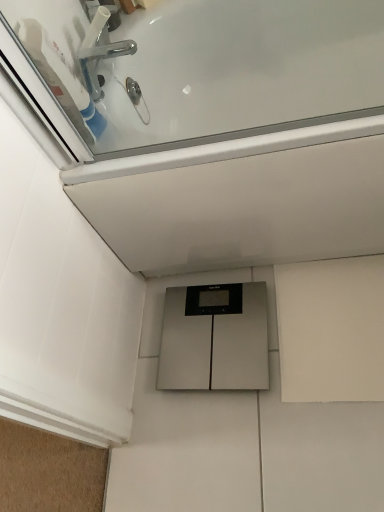
Question: Is silver metallic scale at center smaller than white glossy bathtub at upper center?

Choices:
 (A) no
 (B) yes

Answer: (B)

Question: Is there a large distance between silver metallic scale at center and white glossy bathtub at upper center?

Choices:
 (A) no
 (B) yes

Answer: (A)

Question: Is silver metallic scale at center behind white glossy bathtub at upper center?

Choices:
 (A) yes
 (B) no

Answer: (A)

Question: From the image's perspective, is silver metallic scale at center over white glossy bathtub at upper center?

Choices:
 (A) no
 (B) yes

Answer: (A)

Question: Is silver metallic scale at center closer to camera compared to white glossy bathtub at upper center?

Choices:
 (A) no
 (B) yes

Answer: (A)

Question: Can you confirm if silver metallic scale at center is bigger than white glossy bathtub at upper center?

Choices:
 (A) yes
 (B) no

Answer: (B)

Question: Can you confirm if chrome metallic faucet at upper left is shorter than silver metallic scale at center?

Choices:
 (A) yes
 (B) no

Answer: (B)

Question: Can you confirm if chrome metallic faucet at upper left is positioned to the left of silver metallic scale at center?

Choices:
 (A) yes
 (B) no

Answer: (A)

Question: Considering the relative positions of chrome metallic faucet at upper left and silver metallic scale at center in the image provided, is chrome metallic faucet at upper left in front of silver metallic scale at center?

Choices:
 (A) no
 (B) yes

Answer: (B)

Question: Are chrome metallic faucet at upper left and silver metallic scale at center making contact?

Choices:
 (A) no
 (B) yes

Answer: (A)

Question: From a real-world perspective, does chrome metallic faucet at upper left sit lower than silver metallic scale at center?

Choices:
 (A) yes
 (B) no

Answer: (B)

Question: Is chrome metallic faucet at upper left behind silver metallic scale at center?

Choices:
 (A) yes
 (B) no

Answer: (B)

Question: Is white glossy bathtub at upper center smaller than silver metallic scale at center?

Choices:
 (A) yes
 (B) no

Answer: (B)